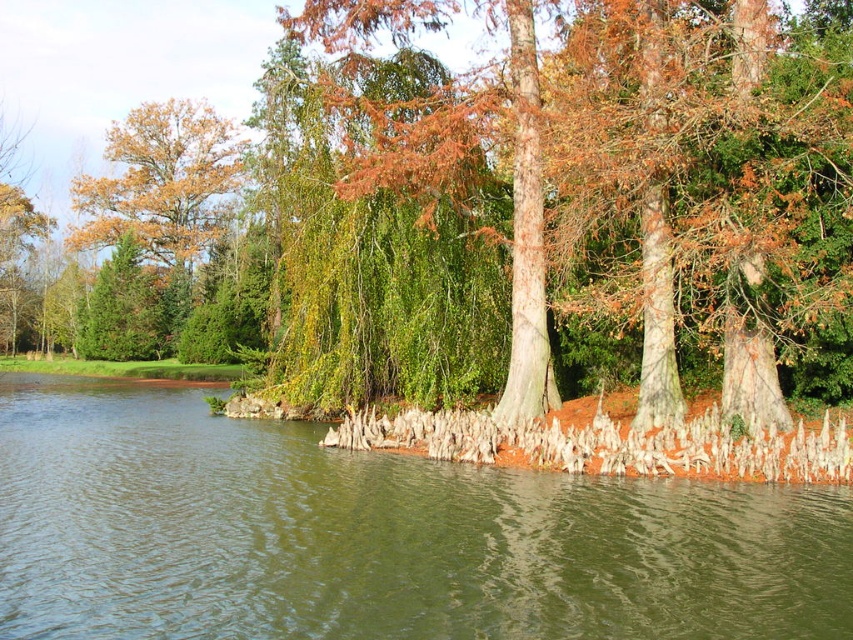
Question: Estimate the real-world distances between objects in this image. Which object is closer to the smooth bark tree at center?

Choices:
 (A) green smooth water at center
 (B) golden oak tree at upper left

Answer: (B)

Question: Can you confirm if green smooth water at center is positioned to the right of smooth bark tree at center?

Choices:
 (A) yes
 (B) no

Answer: (A)

Question: Is smooth bark tree at center bigger than golden oak tree at upper left?

Choices:
 (A) yes
 (B) no

Answer: (A)

Question: Which object appears closest to the camera in this image?

Choices:
 (A) smooth bark tree at center
 (B) green smooth water at center

Answer: (B)

Question: Can you confirm if smooth bark tree at center is positioned to the right of golden oak tree at upper left?

Choices:
 (A) no
 (B) yes

Answer: (B)

Question: Based on their relative distances, which object is nearer to the green smooth water at center?

Choices:
 (A) smooth bark tree at center
 (B) golden oak tree at upper left

Answer: (A)